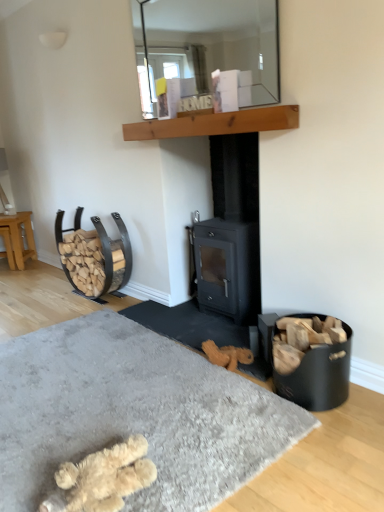
The image size is (384, 512). In order to click on vacant region to the left of fuzzy beige slippers at lower left in this screenshot , I will do `click(29, 466)`.